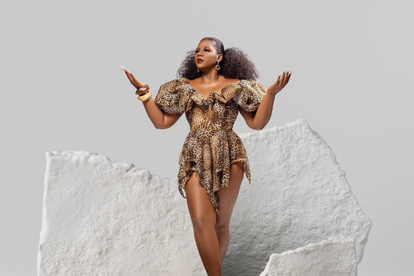
Locate an element on the screen. fridge is located at coordinates (270, 85).